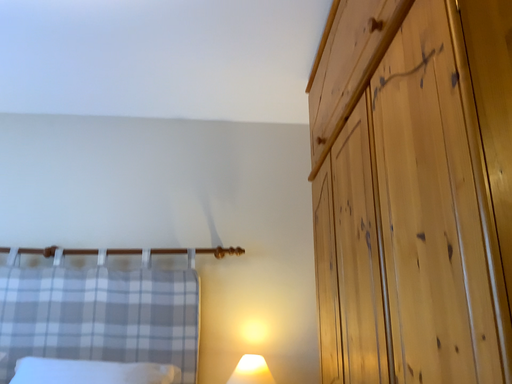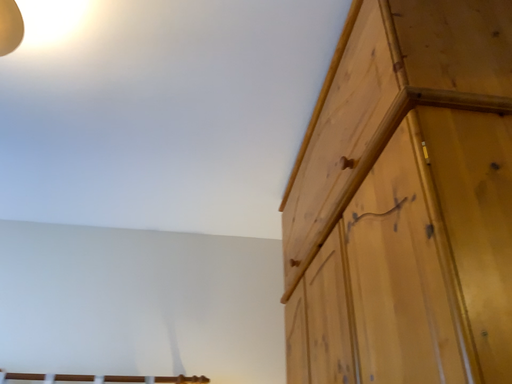
Question: Which way did the camera rotate in the video?

Choices:
 (A) rotated upward
 (B) rotated downward

Answer: (A)